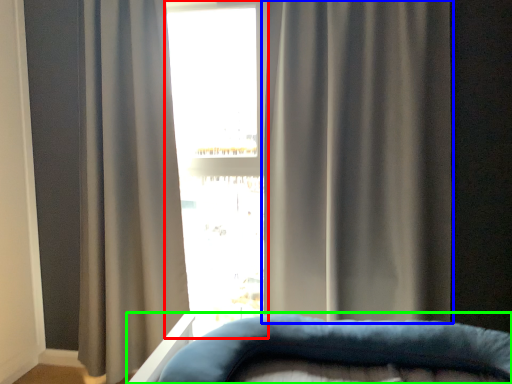
Question: Considering the real-world distances, which object is closest to bay window (highlighted by a red box)? curtain (highlighted by a blue box) or furniture (highlighted by a green box).

Choices:
 (A) curtain
 (B) furniture

Answer: (A)